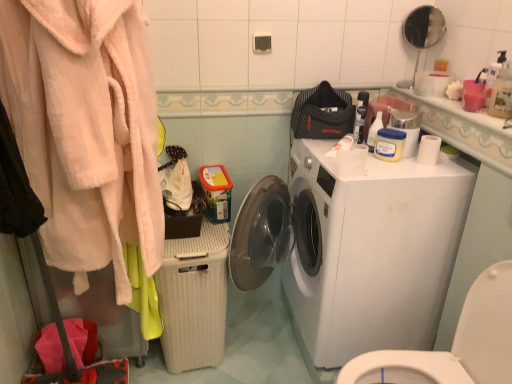
The width and height of the screenshot is (512, 384). In order to click on free space to the left of white matte toilet paper at upper right in this screenshot , I will do `click(393, 168)`.